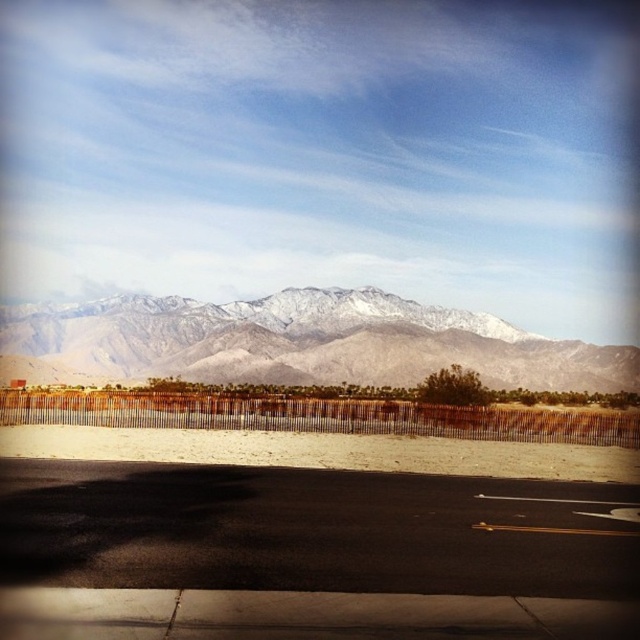
Who is lower down, black asphalt road at lower center or snowy gray mountain range at upper center?

black asphalt road at lower center is below.

Which is in front, point (285, 632) or point (136, 365)?

Positioned in front is point (285, 632).

Who is more forward, (301, 576) or (273, 355)?

Point (301, 576)

The image size is (640, 640). In order to click on black asphalt road at lower center in this screenshot , I will do `click(310, 554)`.